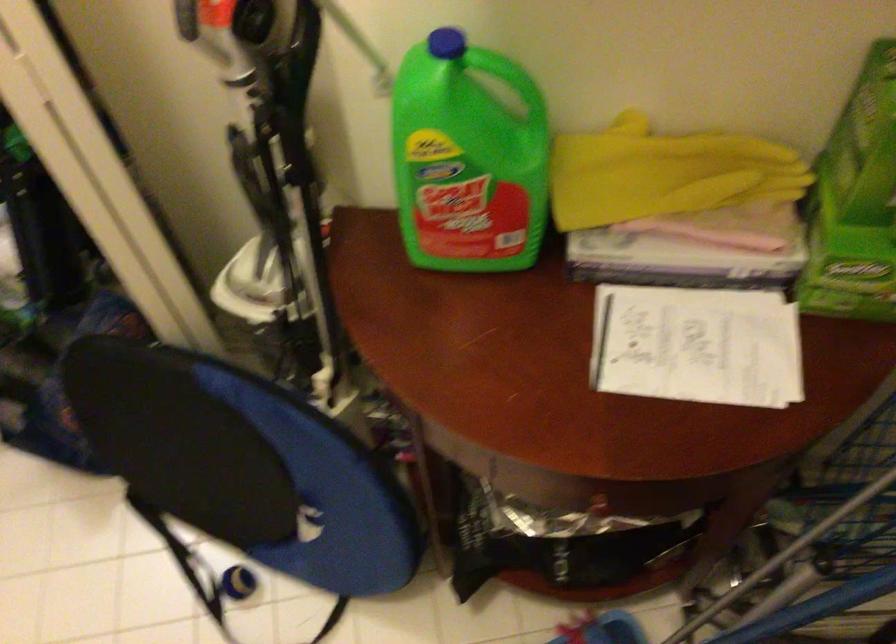
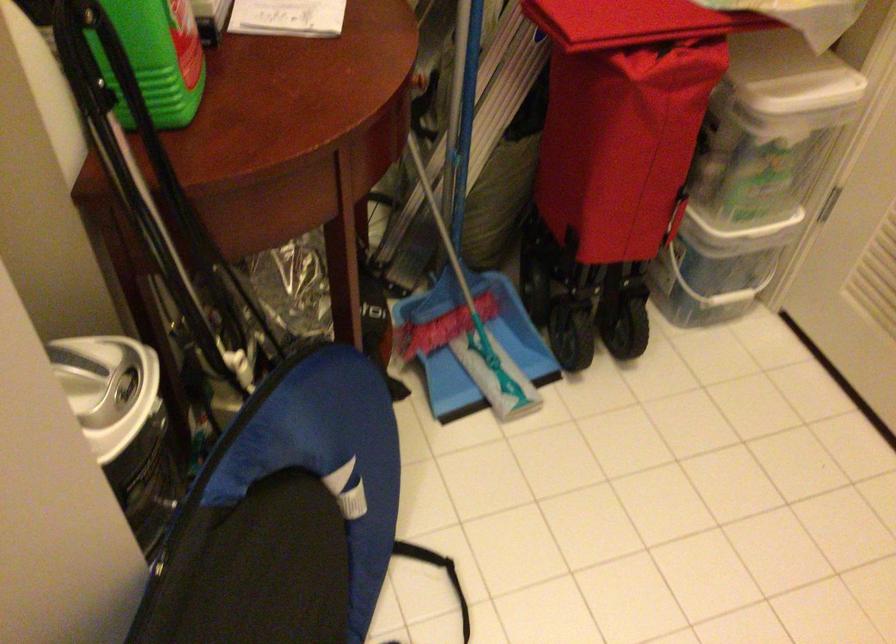
The point at (250, 283) is marked in the first image. Where is the corresponding point in the second image?

(107, 388)